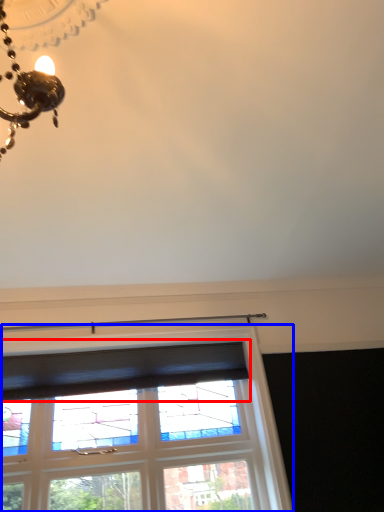
Question: Among these objects, which one is farthest to the camera, curtain (highlighted by a red box) or window (highlighted by a blue box)?

Choices:
 (A) curtain
 (B) window

Answer: (A)